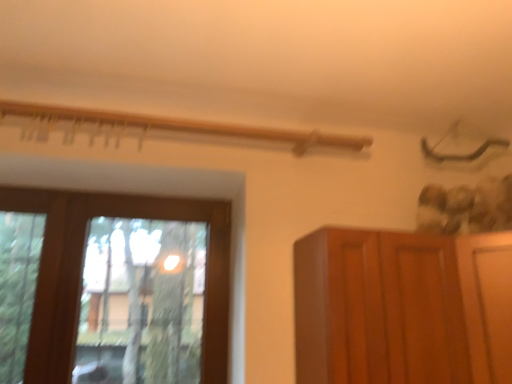
Identify the location of brown wooden cupboard at right. This screenshot has width=512, height=384. (403, 307).

In order to face brown wooden cupboard at right, should I rotate leftwards or rightwards?

Rotate your view right by about 25.153°.

What do you see at coordinates (403, 307) in the screenshot? This screenshot has height=384, width=512. I see `brown wooden cupboard at right` at bounding box center [403, 307].

What is the approximate width of transparent glass window at left?

transparent glass window at left is 4.57 inches in width.

This screenshot has width=512, height=384. What do you see at coordinates (81, 271) in the screenshot? I see `transparent glass window at left` at bounding box center [81, 271].

Locate an element on the screen. This screenshot has height=384, width=512. transparent glass window at left is located at coordinates (81, 271).

Where is `brown wooden cupboard at right`? Image resolution: width=512 pixels, height=384 pixels. brown wooden cupboard at right is located at coordinates (403, 307).

Does brown wooden cupboard at right appear on the left side of transparent glass window at left?

Incorrect, brown wooden cupboard at right is not on the left side of transparent glass window at left.

Is brown wooden cupboard at right in front of or behind transparent glass window at left in the image?

brown wooden cupboard at right is in front of transparent glass window at left.

Is point (379, 327) farther from viewer compared to point (210, 380)?

No, (379, 327) is closer to viewer.

From the image's perspective, between brown wooden cupboard at right and transparent glass window at left, which one is located above?

transparent glass window at left.

From the picture: From a real-world perspective, is brown wooden cupboard at right positioned above or below transparent glass window at left?

In terms of real-world spatial position, brown wooden cupboard at right is below transparent glass window at left.

Considering the relative sizes of brown wooden cupboard at right and transparent glass window at left in the image provided, is brown wooden cupboard at right thinner than transparent glass window at left?

Incorrect, the width of brown wooden cupboard at right is not less than that of transparent glass window at left.

Is brown wooden cupboard at right taller or shorter than transparent glass window at left?

Considering their sizes, brown wooden cupboard at right has less height than transparent glass window at left.

In terms of size, does brown wooden cupboard at right appear bigger or smaller than transparent glass window at left?

In the image, brown wooden cupboard at right appears to be larger than transparent glass window at left.

Is transparent glass window at left surrounded by brown wooden cupboard at right?

No, transparent glass window at left is not a part of brown wooden cupboard at right.

Is brown wooden cupboard at right placed right next to transparent glass window at left?

No, brown wooden cupboard at right is not touching transparent glass window at left.

Could you tell me if brown wooden cupboard at right is turned towards transparent glass window at left?

No, brown wooden cupboard at right does not turn towards transparent glass window at left.

How many degrees apart are the facing directions of brown wooden cupboard at right and transparent glass window at left?

The angular difference between brown wooden cupboard at right and transparent glass window at left is 0.336 degrees.

The height and width of the screenshot is (384, 512). In order to click on window that is above the brown wooden cupboard at right (from the image's perspective) in this screenshot , I will do `click(81, 271)`.

In the image, is transparent glass window at left on the left side or the right side of brown wooden cupboard at right?

Based on their positions, transparent glass window at left is located to the left of brown wooden cupboard at right.

Between transparent glass window at left and brown wooden cupboard at right, which one is positioned in front?

brown wooden cupboard at right is in front.

Is point (125, 212) positioned before point (434, 266)?

That is False.

From the picture: From the image's perspective, is transparent glass window at left below brown wooden cupboard at right?

No.

From a real-world perspective, which is physically above, transparent glass window at left or brown wooden cupboard at right?

transparent glass window at left is physically above.

Considering the sizes of objects transparent glass window at left and brown wooden cupboard at right in the image provided, who is thinner, transparent glass window at left or brown wooden cupboard at right?

transparent glass window at left is thinner.

Considering the sizes of objects transparent glass window at left and brown wooden cupboard at right in the image provided, who is taller, transparent glass window at left or brown wooden cupboard at right?

transparent glass window at left is taller.

Is transparent glass window at left bigger or smaller than brown wooden cupboard at right?

transparent glass window at left is smaller than brown wooden cupboard at right.

Is brown wooden cupboard at right surrounded by transparent glass window at left?

No, brown wooden cupboard at right is located outside of transparent glass window at left.

Is there a large distance between transparent glass window at left and brown wooden cupboard at right?

No, transparent glass window at left is not far from brown wooden cupboard at right.

Is transparent glass window at left oriented away from brown wooden cupboard at right?

No, transparent glass window at left's orientation is not away from brown wooden cupboard at right.

How distant is transparent glass window at left from brown wooden cupboard at right?

The distance of transparent glass window at left from brown wooden cupboard at right is 32.04 inches.

You are a GUI agent. You are given a task and a screenshot of the screen. Output one action in this format:
    pyautogui.click(x=<x>, y=<y>)
    Task: Click on the cupboard located in front of the transparent glass window at left
    Image resolution: width=512 pixels, height=384 pixels.
    Given the screenshot: What is the action you would take?
    pyautogui.click(x=403, y=307)

Locate an element on the screen. Image resolution: width=512 pixels, height=384 pixels. cupboard that appears below the transparent glass window at left (from the image's perspective) is located at coordinates (403, 307).

This screenshot has height=384, width=512. Find the location of `window that appears above the brown wooden cupboard at right (from the image's perspective)`. window that appears above the brown wooden cupboard at right (from the image's perspective) is located at coordinates (81, 271).